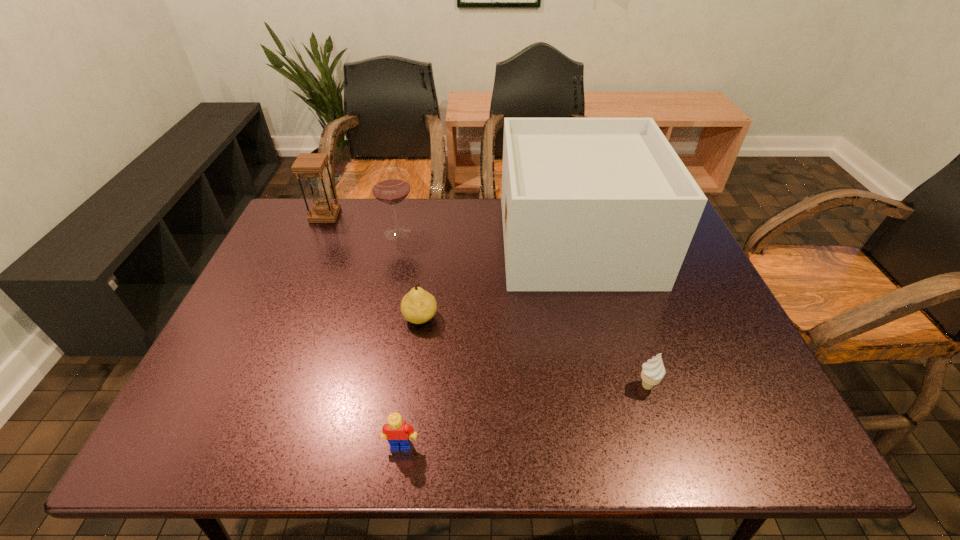
Where is `free spot located 0.240m on the front of the fifth object from right to left`? The width and height of the screenshot is (960, 540). free spot located 0.240m on the front of the fifth object from right to left is located at coordinates (382, 301).

This screenshot has height=540, width=960. Identify the location of vacant region located on the back of the third nearest object. (424, 288).

Image resolution: width=960 pixels, height=540 pixels. I want to click on vacant area situated 0.080m on the front-facing side of the icecream, so click(661, 430).

You are a GUI agent. You are given a task and a screenshot of the screen. Output one action in this format:
    pyautogui.click(x=<x>, y=<y>)
    Task: Click on the box located at the far edge
    The image size is (960, 540).
    Given the screenshot: What is the action you would take?
    coord(588,204)

Where is `hourglass that is positioned at the far edge`? This screenshot has width=960, height=540. hourglass that is positioned at the far edge is located at coordinates (312, 165).

At what (x,y) coordinates should I click in order to perform the action: click on wineglass located at the far edge. Please return your answer as a coordinate pair (x, y). Image resolution: width=960 pixels, height=540 pixels. Looking at the image, I should click on (390, 186).

Locate an element on the screen. The image size is (960, 540). object located in the near edge section of the desktop is located at coordinates (398, 433).

Image resolution: width=960 pixels, height=540 pixels. In order to click on object present at the left edge in this screenshot , I will do `click(312, 165)`.

Where is `object present at the right edge`? object present at the right edge is located at coordinates (588, 204).

Find the location of `object present at the far left corner`. object present at the far left corner is located at coordinates (312, 165).